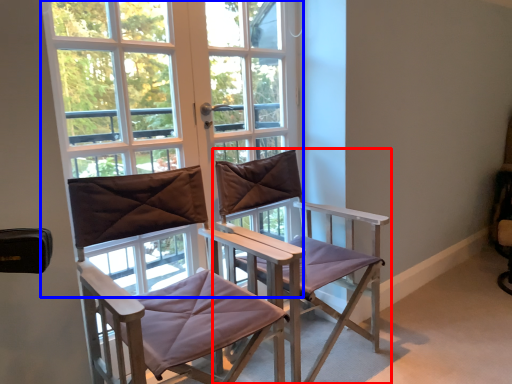
Question: Which object is closer to the camera taking this photo, chair (highlighted by a red box) or window (highlighted by a blue box)?

Choices:
 (A) chair
 (B) window

Answer: (A)